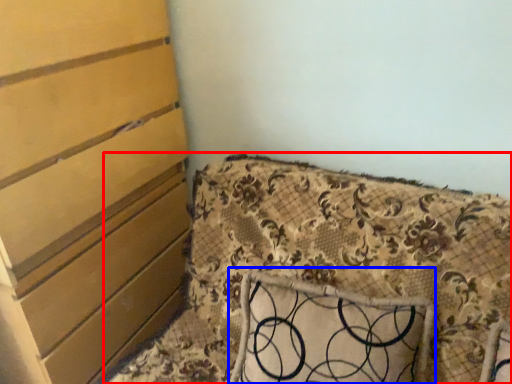
Question: Which point is further to the camera, furniture (highlighted by a red box) or pillow (highlighted by a blue box)?

Choices:
 (A) furniture
 (B) pillow

Answer: (B)